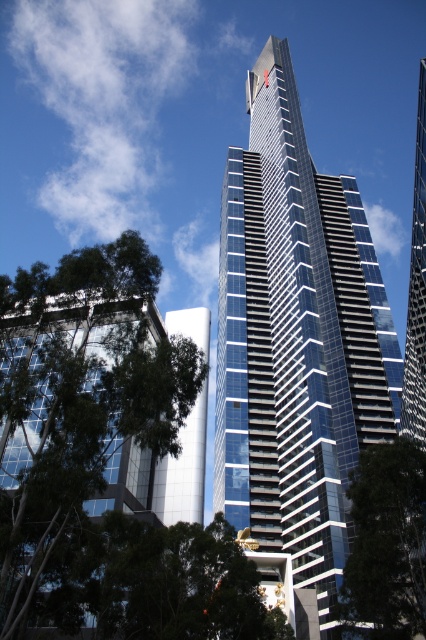
Is green leafy tree at lower left behind green leafy tree at lower right?

That is False.

Who is taller, green leafy tree at lower left or green leafy tree at lower right?

green leafy tree at lower left is taller.

Does point (137, 264) come closer to viewer compared to point (399, 612)?

Yes, it is.

What are the coordinates of `green leafy tree at lower left` in the screenshot? It's located at (80, 396).

Image resolution: width=426 pixels, height=640 pixels. What do you see at coordinates (296, 339) in the screenshot?
I see `glassy blue skyscraper at center` at bounding box center [296, 339].

Can you confirm if glassy blue skyscraper at center is positioned above green leafy tree at lower right?

Yes, glassy blue skyscraper at center is above green leafy tree at lower right.

Find the location of `glassy blue skyscraper at center`. glassy blue skyscraper at center is located at coordinates (296, 339).

Who is lower down, glassy blue skyscraper at center or green leafy tree at lower left?

green leafy tree at lower left is lower down.

Can you confirm if glassy blue skyscraper at center is wider than green leafy tree at lower left?

A: Indeed, glassy blue skyscraper at center has a greater width compared to green leafy tree at lower left.

Find the location of a particular element. glassy blue skyscraper at center is located at coordinates (296, 339).